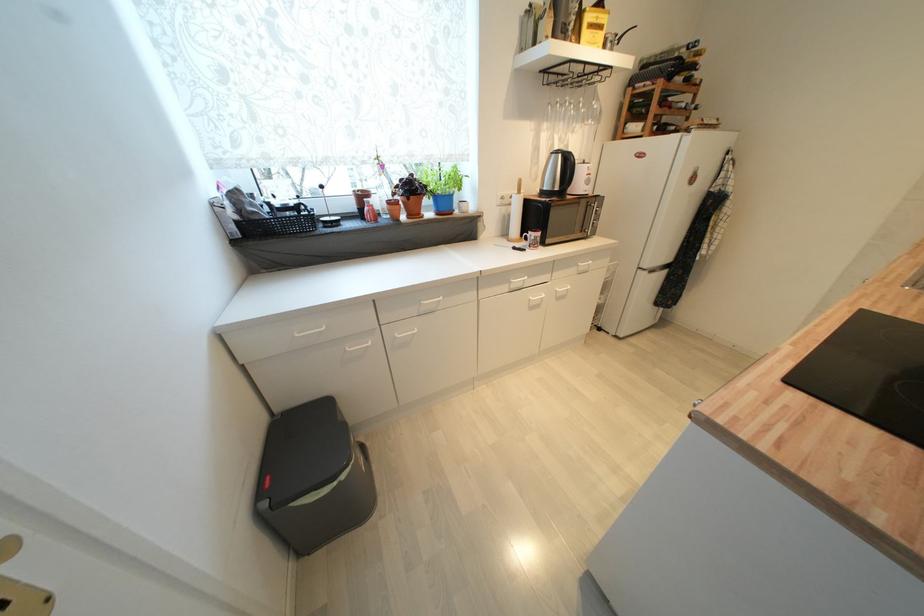
What do you see at coordinates (593, 222) in the screenshot? I see `the microwave door handle` at bounding box center [593, 222].